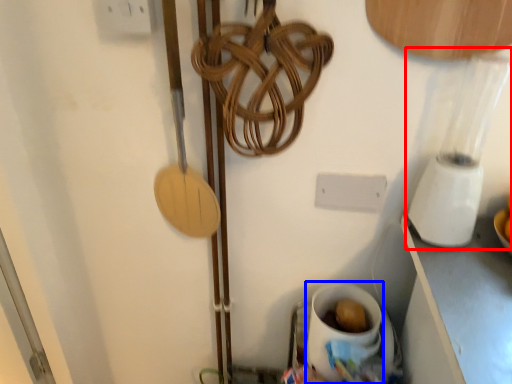
Question: Which object appears farthest to the camera in this image, blender (highlighted by a red box) or coffee cup (highlighted by a blue box)?

Choices:
 (A) blender
 (B) coffee cup

Answer: (B)